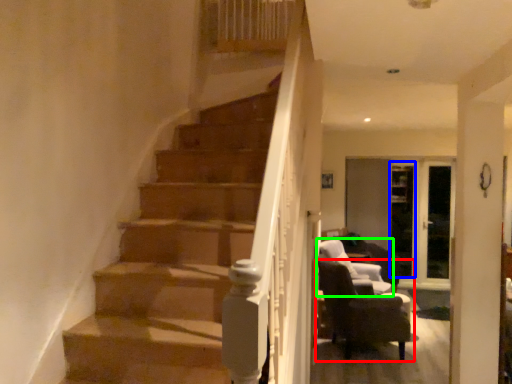
Question: Estimate the real-world distances between objects in this image. Which object is closer to chair (highlighted by a red box), glass door (highlighted by a blue box) or chair (highlighted by a green box)?

Choices:
 (A) glass door
 (B) chair

Answer: (B)